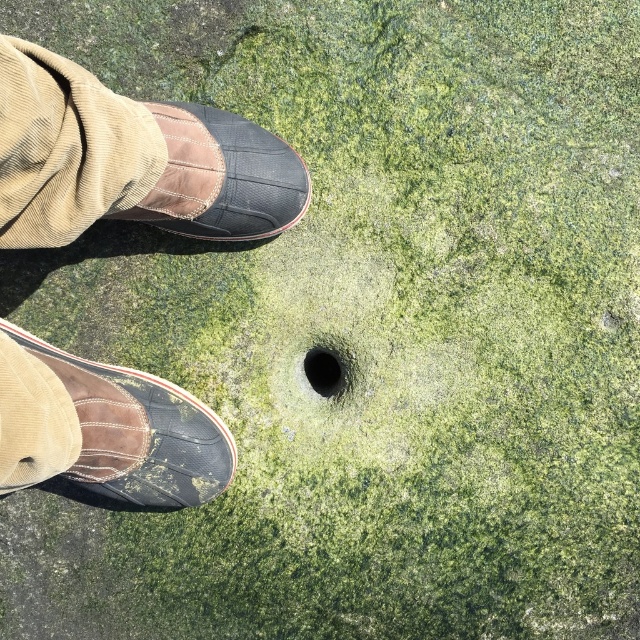
You are a hiker trying to avoid stepping into the black rubber hole at center. You see your brown suede shoe at lower left. Is your shoe currently in a safe position away from the hole?

The brown suede shoe at lower left is positioned under the black rubber hole at center, so the shoe is directly below the hole. To avoid stepping into the hole, you should move your foot away from the current position under the black rubber hole at center.

You are trying to determine which shoe is shorter between the black mesh shoe at upper left and the brown suede shoe at lower left. Based on the scene, which one is shorter?

The black mesh shoe at upper left has a lesser height compared to the brown suede shoe at lower left, so the black mesh shoe at upper left is shorter.

You are trying to avoid stepping into the black rubber hole at center while walking towards the black mesh shoe at upper left. Which object should you move closer to to stay safe?

The black mesh shoe at upper left is much taller than the black rubber hole at center, so moving closer to the black mesh shoe at upper left would keep you away from the hole.